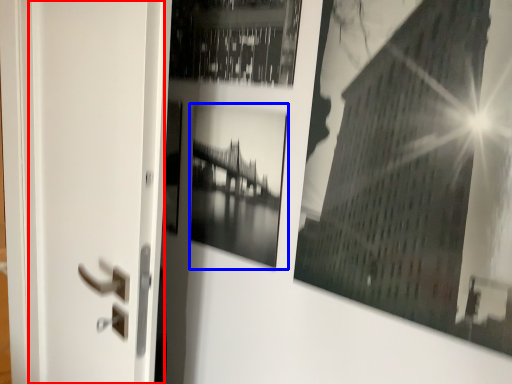
Question: Which object is closer to the camera taking this photo, screen door (highlighted by a red box) or picture frame (highlighted by a blue box)?

Choices:
 (A) screen door
 (B) picture frame

Answer: (A)